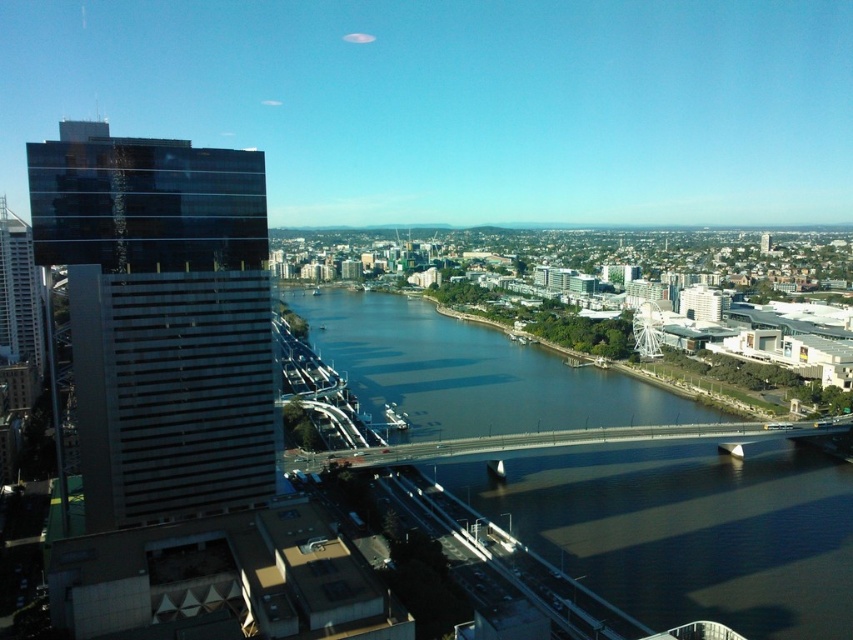
Which is in front, point (521, 378) or point (721, 442)?

Point (721, 442) is more forward.

Is dark blue water at center bigger than smooth concrete bridge at center?

Yes, dark blue water at center is bigger than smooth concrete bridge at center.

This screenshot has width=853, height=640. Identify the location of dark blue water at center. (688, 531).

Does point (45, 140) lie behind point (570, 440)?

That is False.

Can you confirm if dark glass skyscraper at left is taller than smooth concrete bridge at center?

Indeed, dark glass skyscraper at left has a greater height compared to smooth concrete bridge at center.

This screenshot has height=640, width=853. Identify the location of dark glass skyscraper at left. (161, 321).

What do you see at coordinates (688, 531) in the screenshot? This screenshot has height=640, width=853. I see `dark blue water at center` at bounding box center [688, 531].

Looking at this image, between dark blue water at center and dark glass skyscraper at left, which one has more height?

dark glass skyscraper at left

Locate an element on the screen. The image size is (853, 640). dark blue water at center is located at coordinates (688, 531).

The width and height of the screenshot is (853, 640). I want to click on dark blue water at center, so click(x=688, y=531).